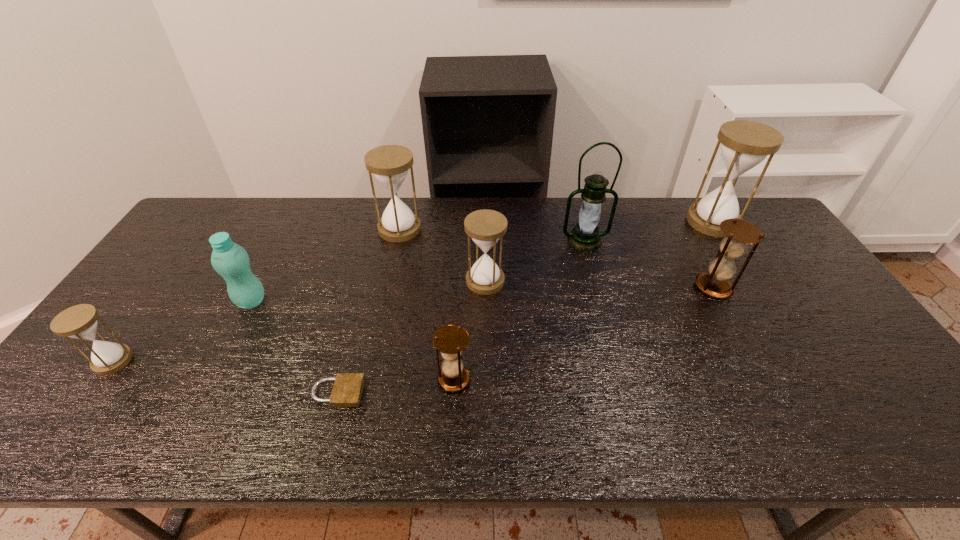
The width and height of the screenshot is (960, 540). In order to click on the farther brown hourglass in this screenshot , I will do `click(739, 233)`.

Where is `the leftmost object`? the leftmost object is located at coordinates click(80, 322).

Find the location of a particular element. The width and height of the screenshot is (960, 540). the leftmost hourglass is located at coordinates (80, 322).

The height and width of the screenshot is (540, 960). What are the coordinates of `the nearer brown hourglass` in the screenshot? It's located at (451, 340).

This screenshot has height=540, width=960. Identify the location of the smaller brown hourglass. (451, 340).

Identify the location of the shortest object. This screenshot has height=540, width=960. (347, 390).

The width and height of the screenshot is (960, 540). In order to click on vacant position located on the side where the lantern emits light in this screenshot , I will do (592, 268).

Locate an element on the screen. The width and height of the screenshot is (960, 540). vacant space located 0.050m on the left of the biggest white hourglass is located at coordinates [673, 221].

Find the location of a particular element. free space located on the right of the fifth hourglass from right to left is located at coordinates 492,229.

The image size is (960, 540). What are the coordinates of `vacant region located on the front of the eighth object from right to left` in the screenshot? It's located at point(210,381).